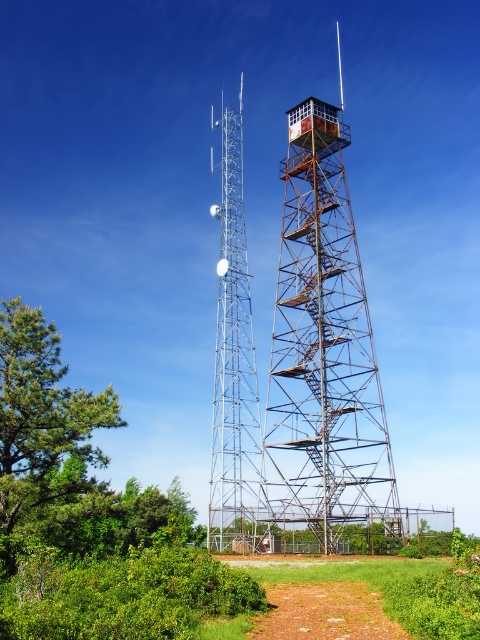
You are standing at point (320,364) in the image. What structure are you at?

You are at the rusty metal fire tower at center located at point (320,364).

You are a hiker standing at the base of the silver metallic tower at center and the brown dirt path at lower center. Which structure would you need to look upward more to see the top of?

The silver metallic tower at center is taller than the brown dirt path at lower center, so you would need to look upward more to see the top of the silver metallic tower at center.

You are standing at the point marked at coordinates point [272,378]. You want to walk to the tall, slender metal tower on the left. Which direction should you go?

Since the point [272,378] is closer to the tall, slender metal tower on the left than the fire observation tower on the right, you should go towards the left to reach the tower.